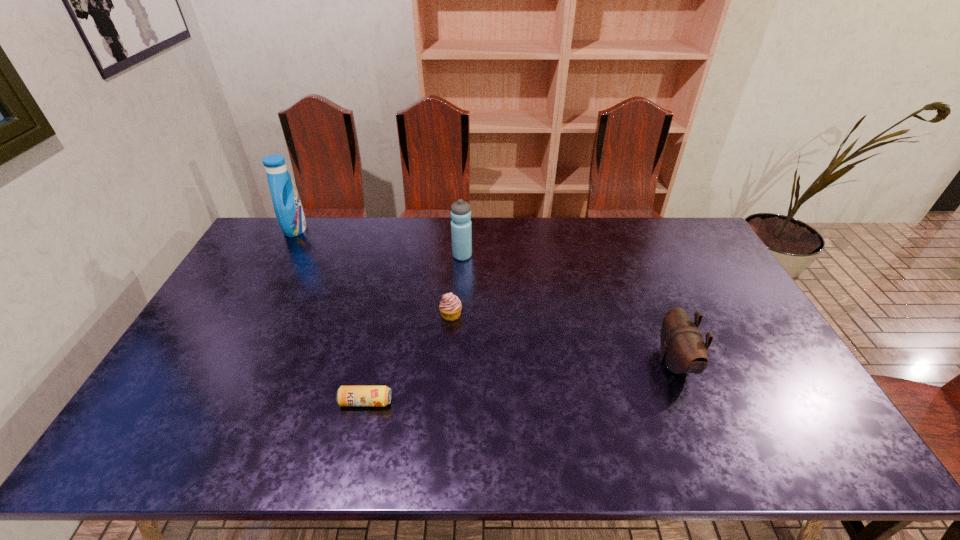
The width and height of the screenshot is (960, 540). I want to click on the tallest object, so click(x=287, y=205).

Find the location of a particular element. the leftmost object is located at coordinates (287, 205).

Where is `water bottle`? The height and width of the screenshot is (540, 960). water bottle is located at coordinates (461, 226).

Where is `the fourth shortest object`? the fourth shortest object is located at coordinates (461, 226).

Locate an element on the screen. The image size is (960, 540). the third shortest object is located at coordinates (683, 350).

Image resolution: width=960 pixels, height=540 pixels. I want to click on the rightmost object, so click(683, 350).

Where is `cupcake`? This screenshot has width=960, height=540. cupcake is located at coordinates (450, 307).

You are a GUI agent. You are given a task and a screenshot of the screen. Output one action in this format:
    pyautogui.click(x=<x>, y=<y>)
    Task: Click on the third farthest object
    The height and width of the screenshot is (540, 960).
    Given the screenshot: What is the action you would take?
    pyautogui.click(x=450, y=307)

This screenshot has height=540, width=960. Find the location of `the shortest object`. the shortest object is located at coordinates (346, 395).

You are a GUI agent. You are given a task and a screenshot of the screen. Output one action in this format:
    pyautogui.click(x=<x>, y=<y>)
    Task: Click on the nearest object
    
    Given the screenshot: What is the action you would take?
    pyautogui.click(x=346, y=395)